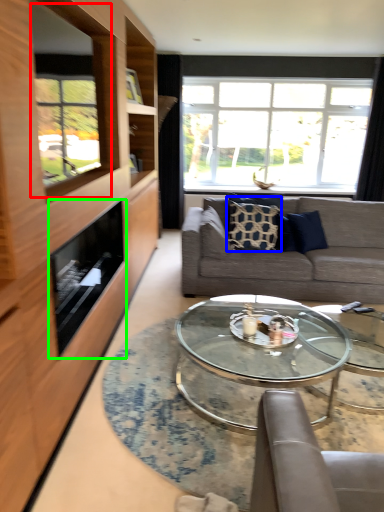
Question: Which is farther away from window screen (highlighted by a red box)? pillow (highlighted by a blue box) or appliance (highlighted by a green box)?

Choices:
 (A) pillow
 (B) appliance

Answer: (A)